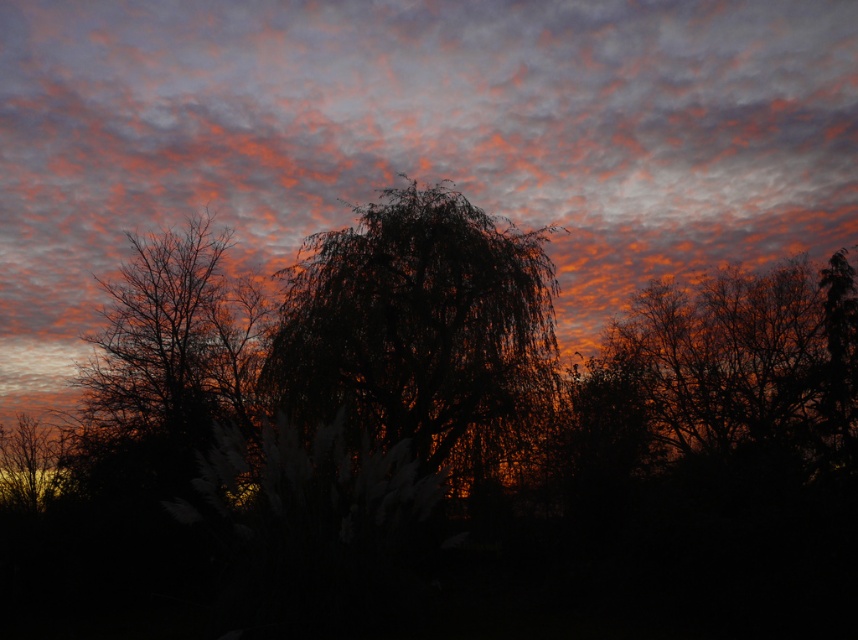
You are a bird flying at an altitude of 20 feet. You see the orange matte cloud at upper center and the silhouette tree at right. Can you safely fly between them without hitting either?

The orange matte cloud at upper center is 22.53 feet from the silhouette tree at right. Since you are flying at 20 feet altitude, the vertical distance between you and the cloud might be insufficient, so there is a risk of collision. However, horizontal distance is 22.53 feet, which is greater than your altitude. It depends on the vertical positioning. But since the cloud is above and the tree is below, you can fly between them safely by adjusting your path.

You are an artist sketching the sunset scene. You want to draw the dark matte tree at center and the silhouette tree at left accurately. Which tree should you draw taller?

The silhouette tree at left is taller than the dark matte tree at center, so you should draw the silhouette tree at left taller.

You are an astronomer analyzing the sunset scene. You need to locate the orange matte cloud at upper center in the image. What are its coordinates?

The orange matte cloud at upper center is located at coordinates point (414, 140).